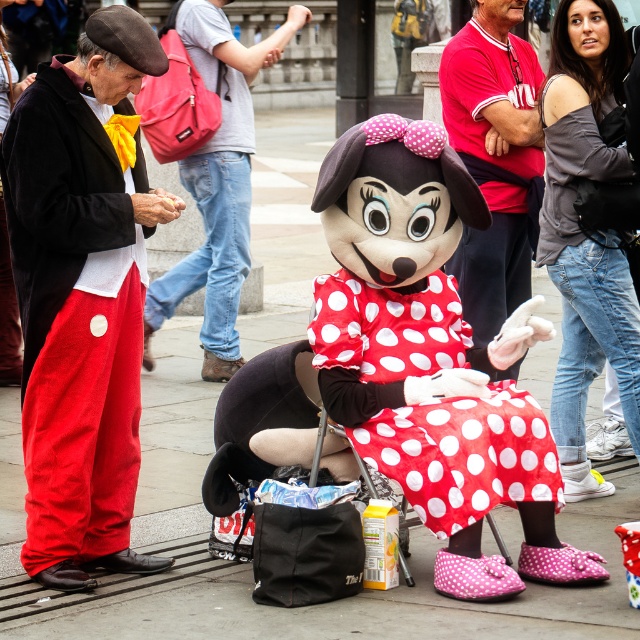
Is velvet red pants at left positioned before polka dot fabric minnie mouse at center?

Yes, velvet red pants at left is in front of polka dot fabric minnie mouse at center.

Who is more forward, (74, 376) or (214, 58)?

Point (74, 376) is in front.

Identify the location of velvet red pants at left. (83, 296).

Between red polka dot fabric dress at center and red cotton shirt at center, which one has more height?

Standing taller between the two is red cotton shirt at center.

Does red polka dot fabric dress at center appear over red cotton shirt at center?

Incorrect, red polka dot fabric dress at center is not positioned above red cotton shirt at center.

Which is behind, point (326, 289) or point (509, 273)?

The point (509, 273) is more distant.

Where is `red polka dot fabric dress at center`? red polka dot fabric dress at center is located at coordinates (464, 454).

Is point (45, 100) behind point (509, 448)?

That is False.

Which is below, velvet red pants at left or red polka dot fabric dress at center?

red polka dot fabric dress at center

Is point (33, 413) positioned after point (442, 506)?

Yes.

The width and height of the screenshot is (640, 640). Find the location of `velvet red pants at left`. velvet red pants at left is located at coordinates (83, 296).